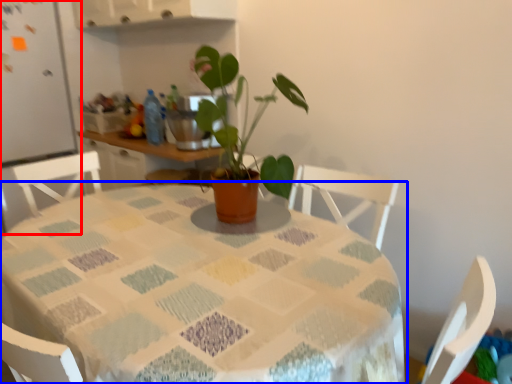
Question: Which of the following is the farthest to the observer, fridge (highlighted by a red box) or table (highlighted by a blue box)?

Choices:
 (A) fridge
 (B) table

Answer: (A)